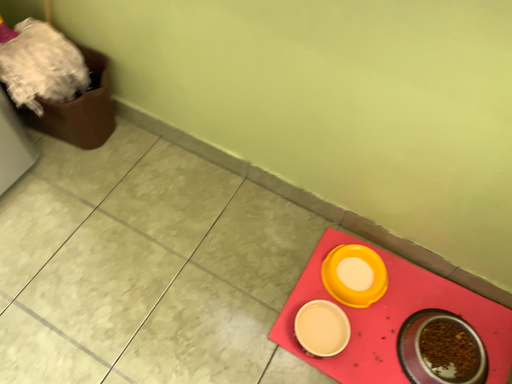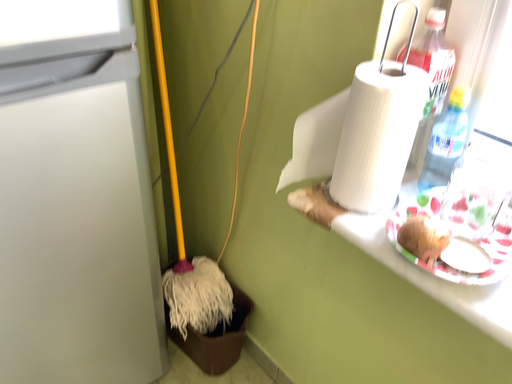
Question: Which way did the camera rotate in the video?

Choices:
 (A) rotated downward
 (B) rotated upward

Answer: (B)